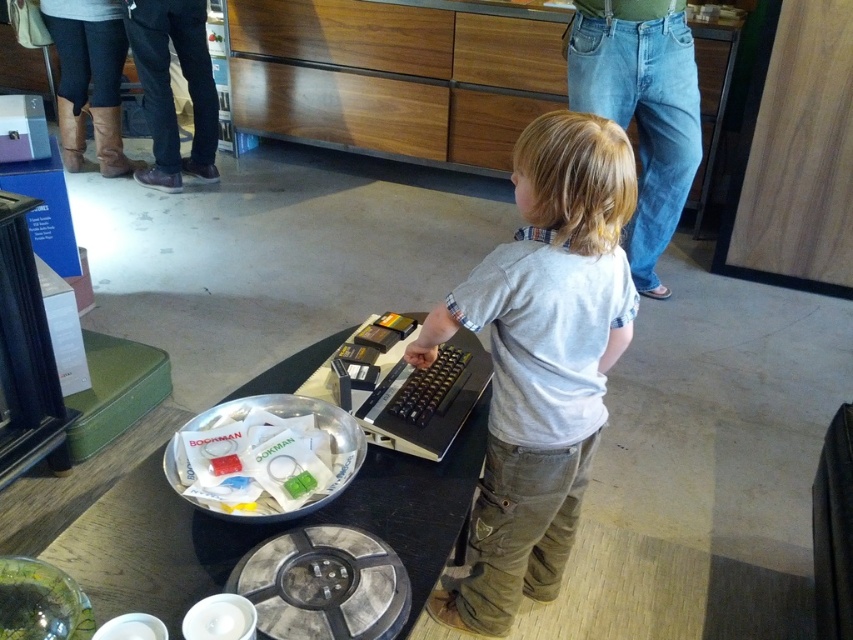
Where is the light gray cotton shirt at center located in the image?

The light gray cotton shirt at center is located at point 0.562 on the x axis and 0.635 on the y axis.

You are a photographer setting up a shoot in this room. You want to ensure that the light gray cotton shirt at center and the white paper at center are both visible in the frame. Given their sizes, which object should you position closer to the camera to maintain clarity in the photo?

The light gray cotton shirt at center is much taller than the white paper at center, so positioning the light gray cotton shirt at center closer to the camera will help maintain clarity for both objects in the photo.